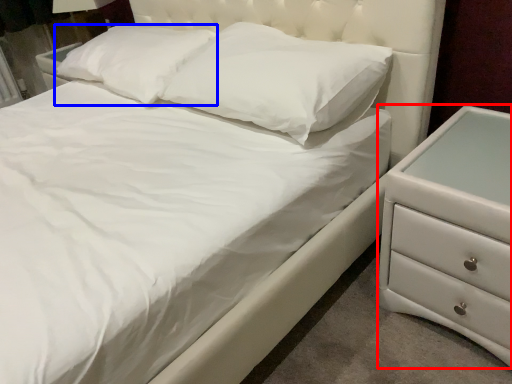
Question: Which of the following is the farthest to the observer, chest of drawers (highlighted by a red box) or pillow (highlighted by a blue box)?

Choices:
 (A) chest of drawers
 (B) pillow

Answer: (B)